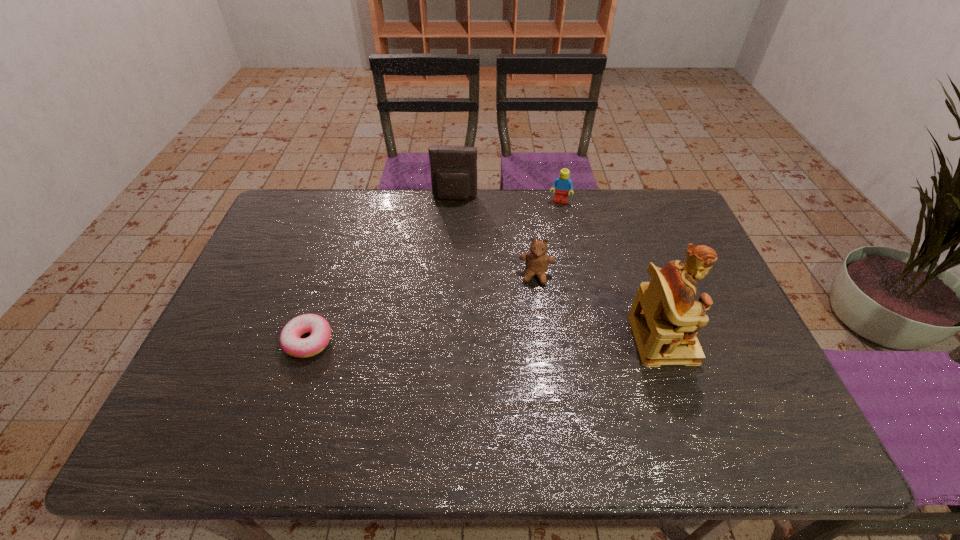
Identify which object is the second closest to the Lego. Please provide its 2D coordinates. Your answer should be formatted as a tuple, i.e. [(x, y)], where the tuple contains the x and y coordinates of a point satisfying the conditions above.

[(537, 260)]

Find the location of a particular element. This screenshot has height=540, width=960. vacant space that satisfies the following two spatial constraints: 1. on the back side of the teddy bear; 2. on the left side of the leftmost object is located at coordinates (330, 275).

At what (x,y) coordinates should I click in order to perform the action: click on free space that satisfies the following two spatial constraints: 1. on the front side of the pouch; 2. on the front-facing side of the rightmost object. Please return your answer as a coordinate pair (x, y). The image size is (960, 540). Looking at the image, I should click on (445, 339).